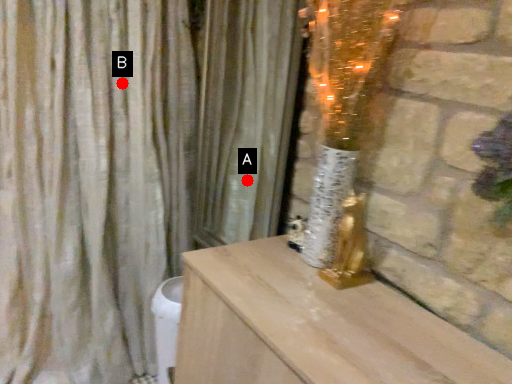
Question: Two points are circled on the image, labeled by A and B beside each circle. Which point is closer to the camera?

Choices:
 (A) A is closer
 (B) B is closer

Answer: (B)